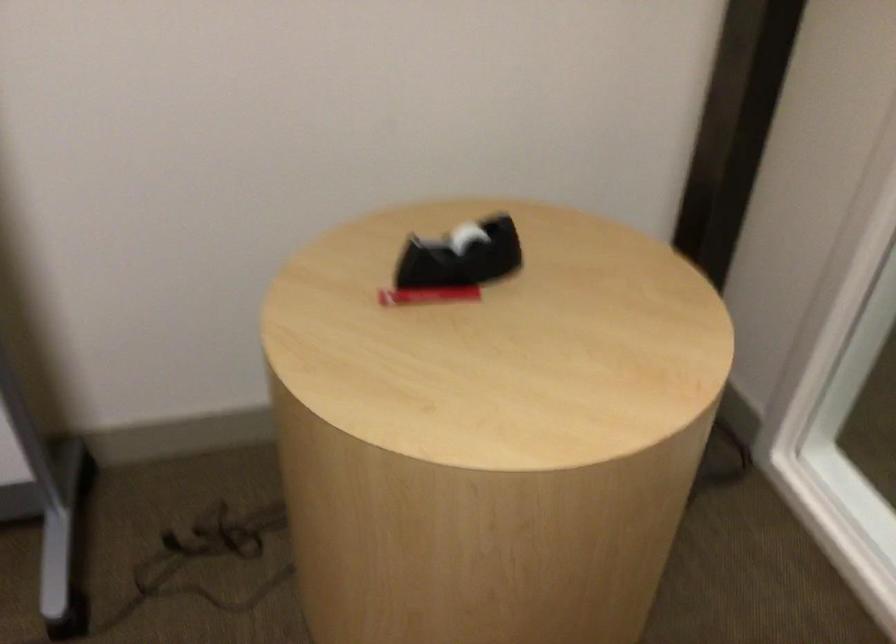
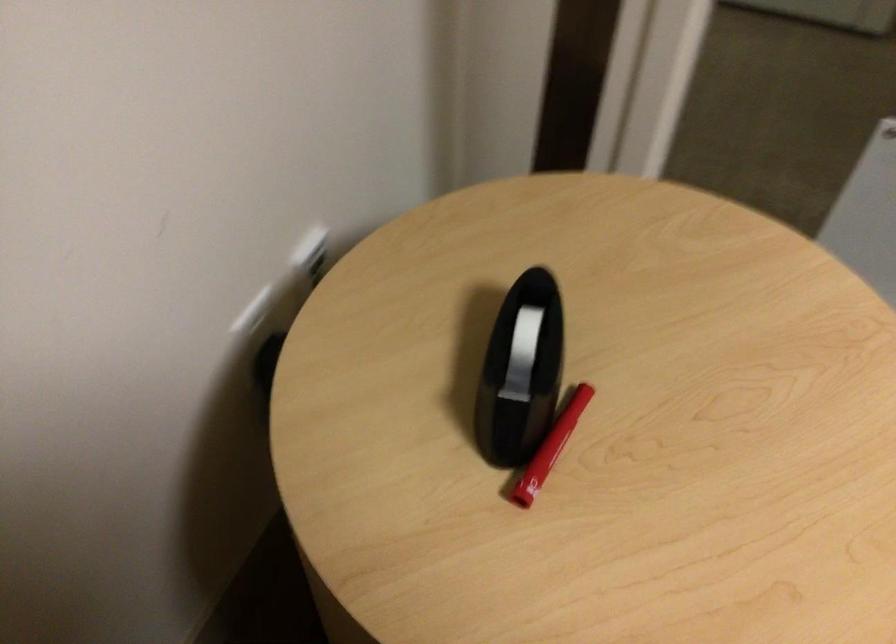
The images are taken continuously from a first-person perspective. In which direction is your viewpoint rotating?

The camera rotated toward right-down.